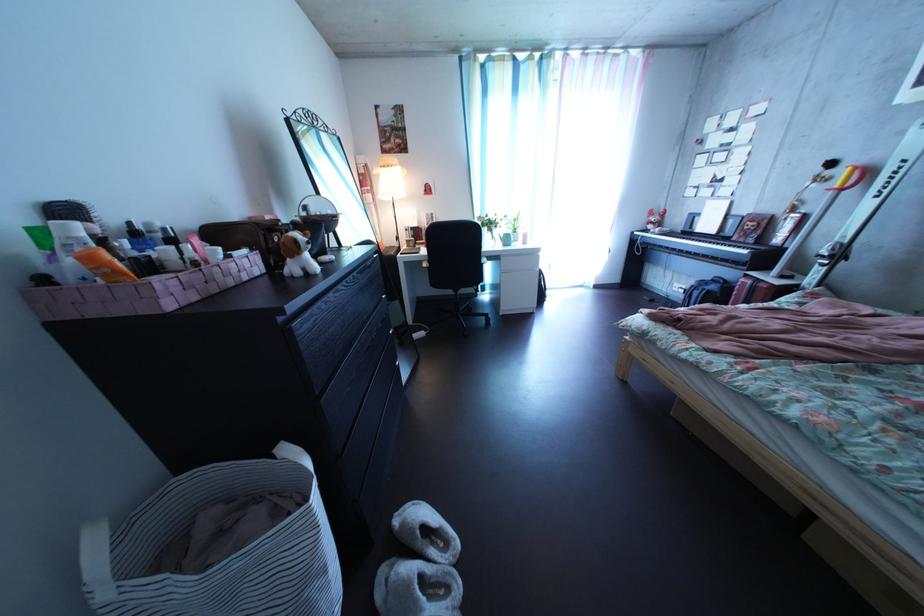
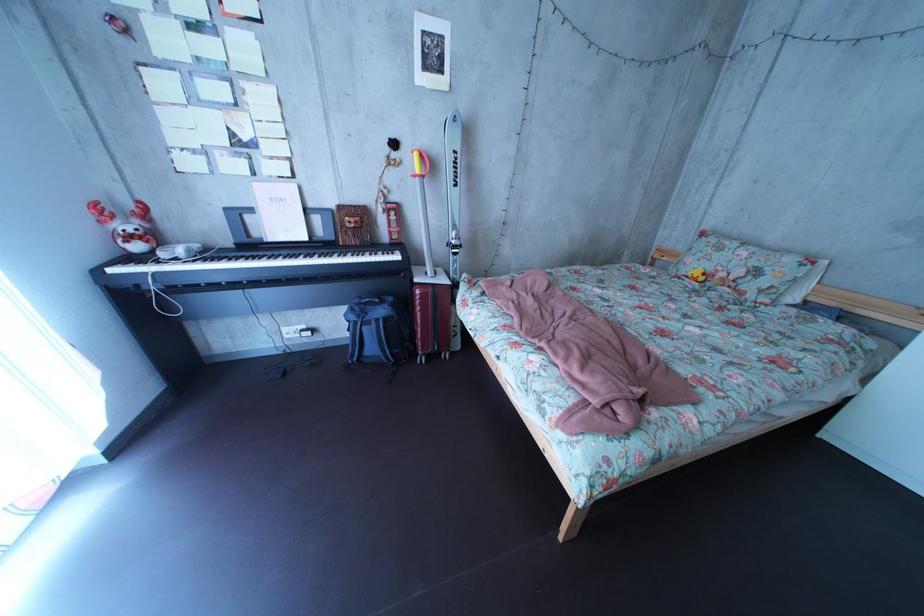
Locate, in the second image, the point that corresponds to [673,233] in the first image.

(169, 246)